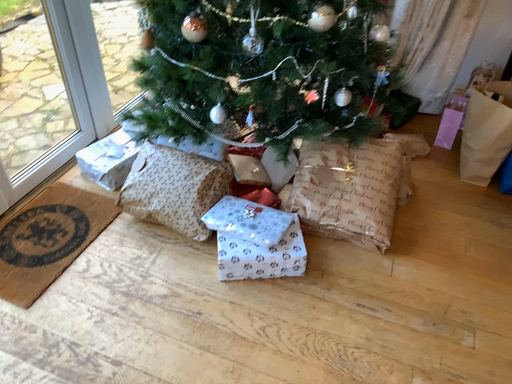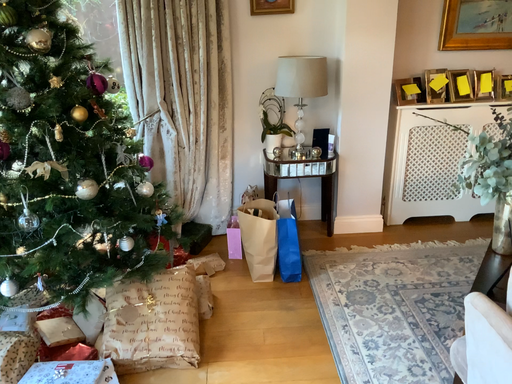
Question: How did the camera likely rotate when shooting the video?

Choices:
 (A) rotated left
 (B) rotated right

Answer: (B)